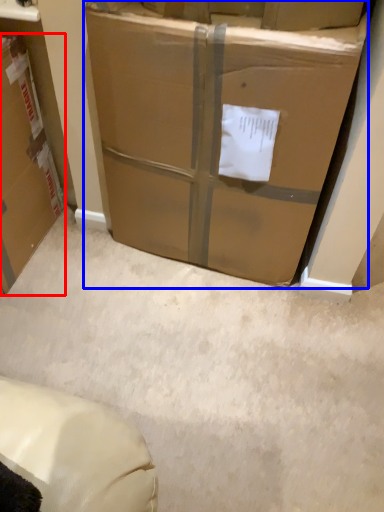
Question: Which of the following is the closest to the observer, box (highlighted by a red box) or box (highlighted by a blue box)?

Choices:
 (A) box
 (B) box

Answer: (B)